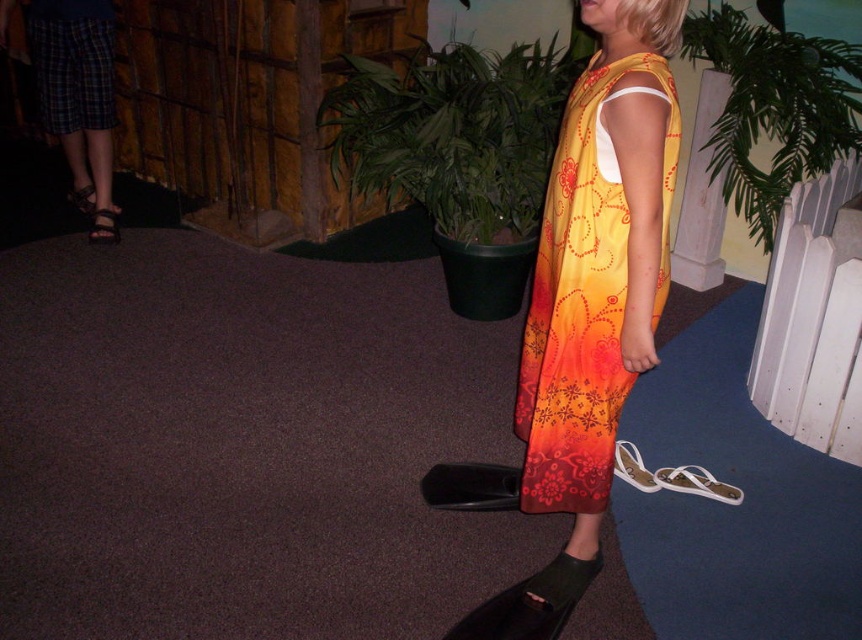
Is green leafy plant at upper center positioned behind plaid fabric skirt at left?

No, green leafy plant at upper center is in front of plaid fabric skirt at left.

Identify the location of green leafy plant at upper center. (453, 132).

Does plaid fabric skirt at left have a smaller size compared to brown leather sandal at left?

No.

At what (x,y) coordinates should I click in order to perform the action: click on plaid fabric skirt at left. Please return your answer as a coordinate pair (x, y). Image resolution: width=862 pixels, height=640 pixels. Looking at the image, I should click on (72, 61).

The image size is (862, 640). I want to click on plaid fabric skirt at left, so click(x=72, y=61).

Which is behind, point (561, 177) or point (534, 573)?

Point (534, 573)

Is point (604, 230) positioned in front of point (579, 589)?

Yes, it is in front of point (579, 589).

Where is `floral print fabric dress at center`? floral print fabric dress at center is located at coordinates (583, 304).